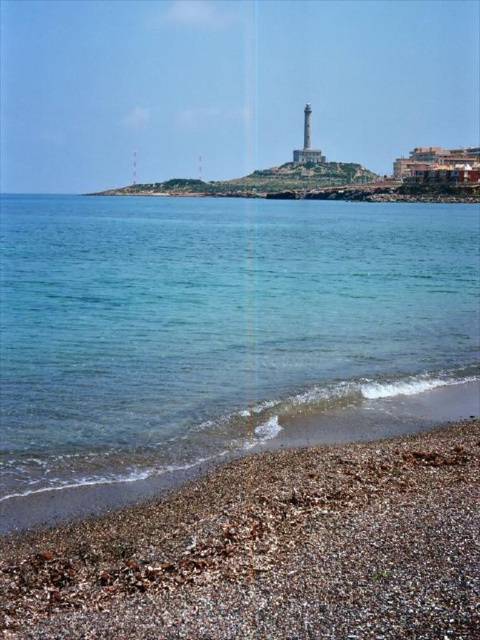
Question: Among these objects, which one is farthest from the camera?

Choices:
 (A) clear water at lower left
 (B) smooth pebbles at lower right

Answer: (A)

Question: Does clear water at lower left appear on the left side of smooth pebbles at lower right?

Choices:
 (A) no
 (B) yes

Answer: (A)

Question: Is clear water at lower left further to the viewer compared to smooth pebbles at lower right?

Choices:
 (A) no
 (B) yes

Answer: (B)

Question: Which point appears farthest from the camera in this image?

Choices:
 (A) (447, 300)
 (B) (292, 488)

Answer: (A)

Question: Is clear water at lower left below smooth pebbles at lower right?

Choices:
 (A) yes
 (B) no

Answer: (B)

Question: Which point is closer to the camera?

Choices:
 (A) clear water at lower left
 (B) smooth pebbles at lower right

Answer: (B)